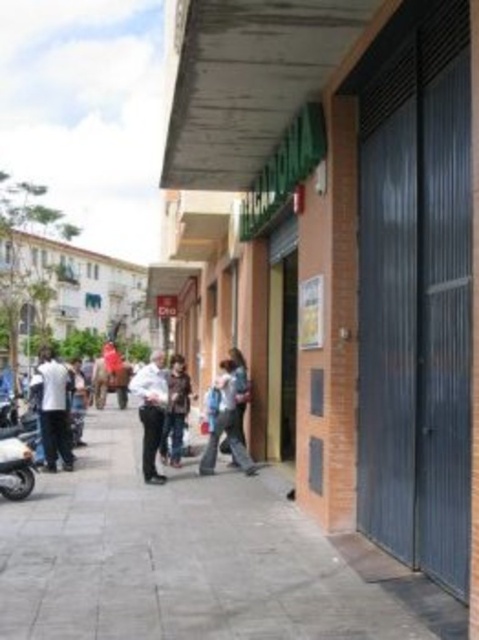
Which is below, brick wall at center or shiny metallic motorcycle at lower left?

shiny metallic motorcycle at lower left

Can you confirm if brick wall at center is bigger than shiny metallic motorcycle at lower left?

Indeed, brick wall at center has a larger size compared to shiny metallic motorcycle at lower left.

Where is `brick wall at center`? The image size is (479, 640). brick wall at center is located at coordinates pos(337,252).

Image resolution: width=479 pixels, height=640 pixels. I want to click on brick wall at center, so click(x=337, y=252).

Who is lower down, gray concrete pavement at center or dark brown leather jacket at center?

gray concrete pavement at center

Can you confirm if gray concrete pavement at center is positioned to the right of dark brown leather jacket at center?

Correct, you'll find gray concrete pavement at center to the right of dark brown leather jacket at center.

Which is in front, point (206, 573) or point (174, 392)?

Point (206, 573)

Locate an element on the screen. This screenshot has width=479, height=640. gray concrete pavement at center is located at coordinates (194, 560).

Is point (216, 452) behind point (179, 387)?

No.

Which is more to the left, denim jacket at center or dark brown leather jacket at center?

dark brown leather jacket at center

Where is `denim jacket at center`? denim jacket at center is located at coordinates (227, 422).